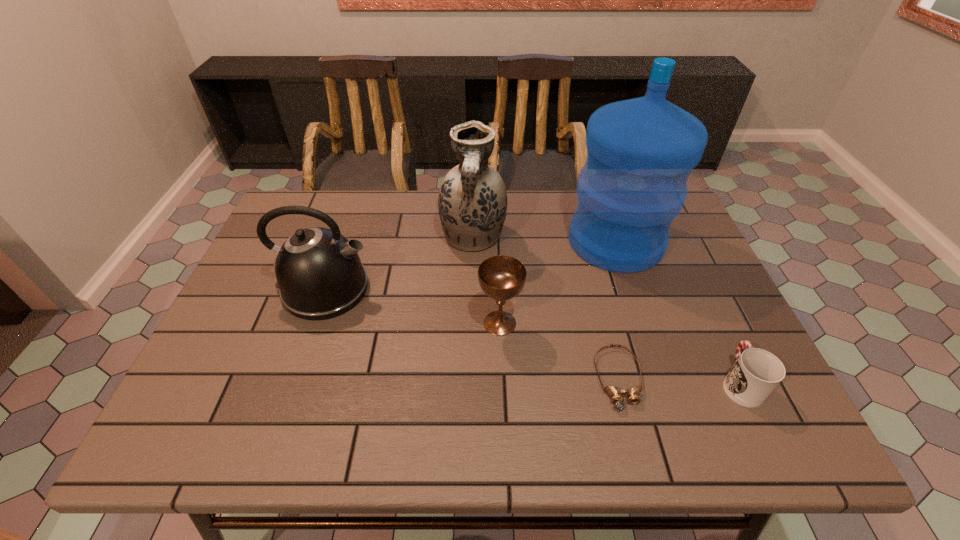
Where is `cup located at the right edge`? This screenshot has height=540, width=960. cup located at the right edge is located at coordinates (756, 372).

Locate an element on the screen. This screenshot has height=540, width=960. object present at the far right corner is located at coordinates (641, 151).

The height and width of the screenshot is (540, 960). I want to click on vacant space at the near edge of the desktop, so click(x=665, y=429).

In the image, there is a desktop. Find the location of `blank space at the left edge`. blank space at the left edge is located at coordinates (242, 369).

Locate an element on the screen. The height and width of the screenshot is (540, 960). free space at the right edge is located at coordinates [x=669, y=315].

Identify the location of free space at the far right corner of the desktop. (682, 222).

At what (x,y) coordinates should I click in order to perform the action: click on vacant space that's between the goggles and the kettle. Please return your answer as a coordinate pair (x, y). The width and height of the screenshot is (960, 540). Looking at the image, I should click on (472, 334).

You are a GUI agent. You are given a task and a screenshot of the screen. Output one action in this format:
    pyautogui.click(x=<x>, y=<y>)
    Task: Click on the empty space that is in between the chalice and the fifth tallest object
    
    Given the screenshot: What is the action you would take?
    pyautogui.click(x=620, y=353)

The height and width of the screenshot is (540, 960). In order to click on free area in between the shortest object and the leftmost object in this screenshot , I will do `click(472, 334)`.

Find the location of a particular element. The height and width of the screenshot is (540, 960). unoccupied position between the water jug and the vase is located at coordinates (544, 239).